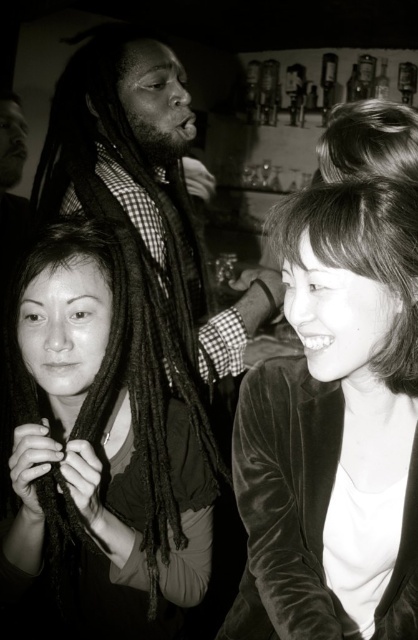
Question: Which point is closer to the camera?

Choices:
 (A) (380, 349)
 (B) (297, 260)

Answer: (B)

Question: Which point is farther to the camera?

Choices:
 (A) (158, 608)
 (B) (385, 449)
 (C) (410, 316)

Answer: (A)

Question: Is velvet-like hair at center below smooth dark hair at lower right?

Choices:
 (A) yes
 (B) no

Answer: (A)

Question: Is velvet black jacket at lower right positioned in front of smooth dark hair at lower right?

Choices:
 (A) no
 (B) yes

Answer: (B)

Question: In this image, where is velvet black jacket at lower right located relative to smooth dark hair at lower right?

Choices:
 (A) above
 (B) below

Answer: (B)

Question: Which point is farther to the camera?

Choices:
 (A) (395, 376)
 (B) (354, 200)

Answer: (A)